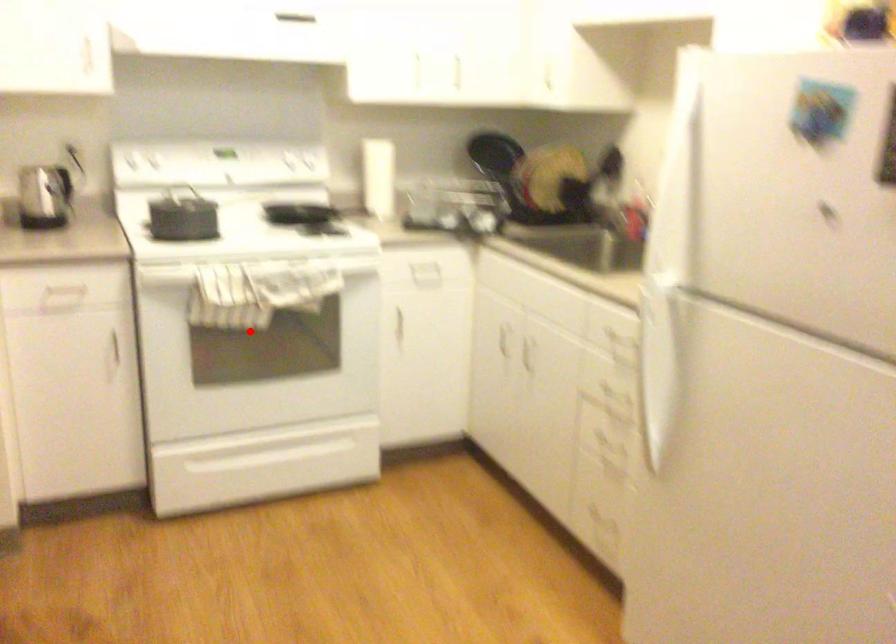
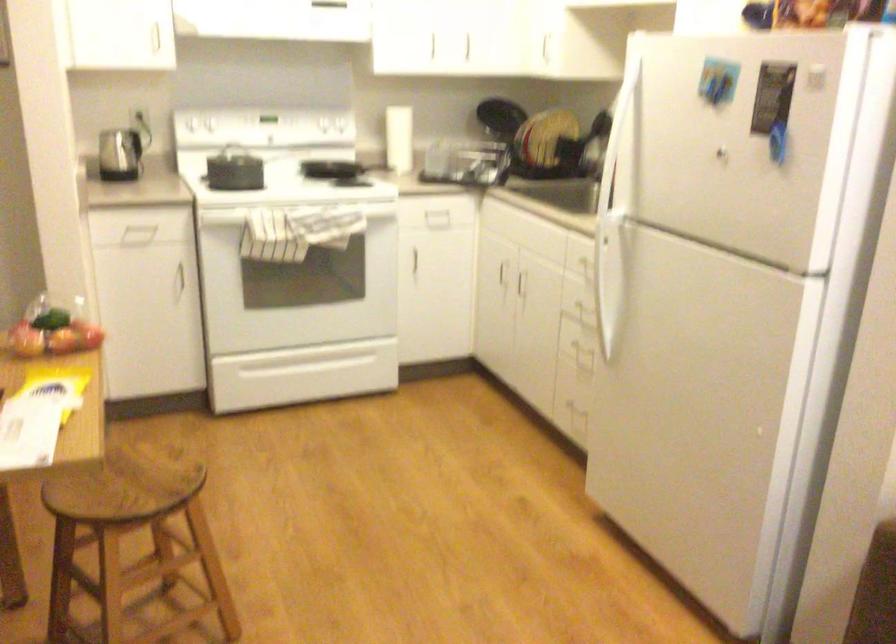
Question: I am providing you with two images of the same scene from different viewpoints. Image1 has a red point marked. In image2, the corresponding 3D location appears at what relative position? Reply with the corresponding letter.

Choices:
 (A) Closer
 (B) Farther

Answer: (B)